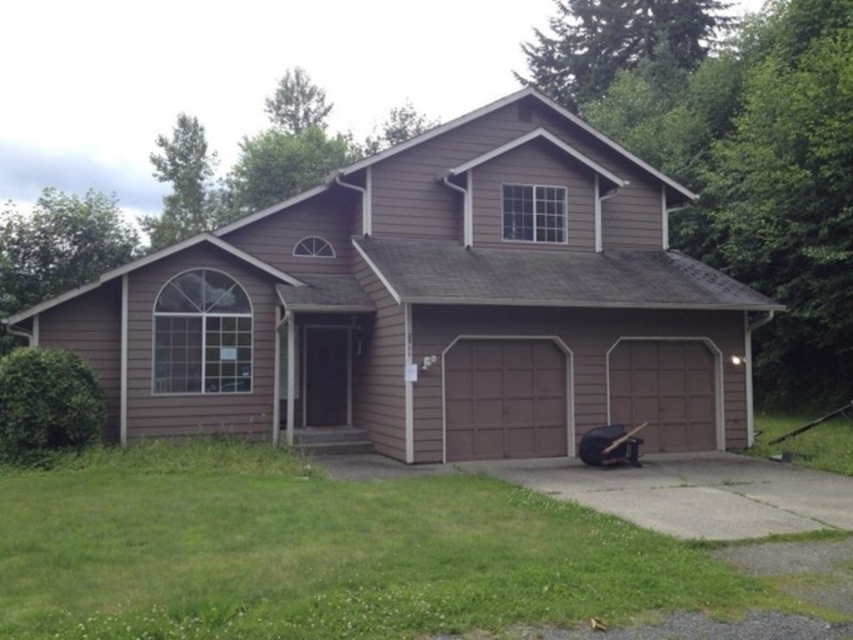
Does point (105, 312) come closer to viewer compared to point (471, 458)?

That is False.

Can you confirm if brown wood garage at center is positioned below brown matte/glossy garage door at center?

Actually, brown wood garage at center is above brown matte/glossy garage door at center.

The image size is (853, 640). In order to click on brown wood garage at center in this screenshot , I will do `click(430, 305)`.

Where is `brown wood garage at center`? brown wood garage at center is located at coordinates (430, 305).